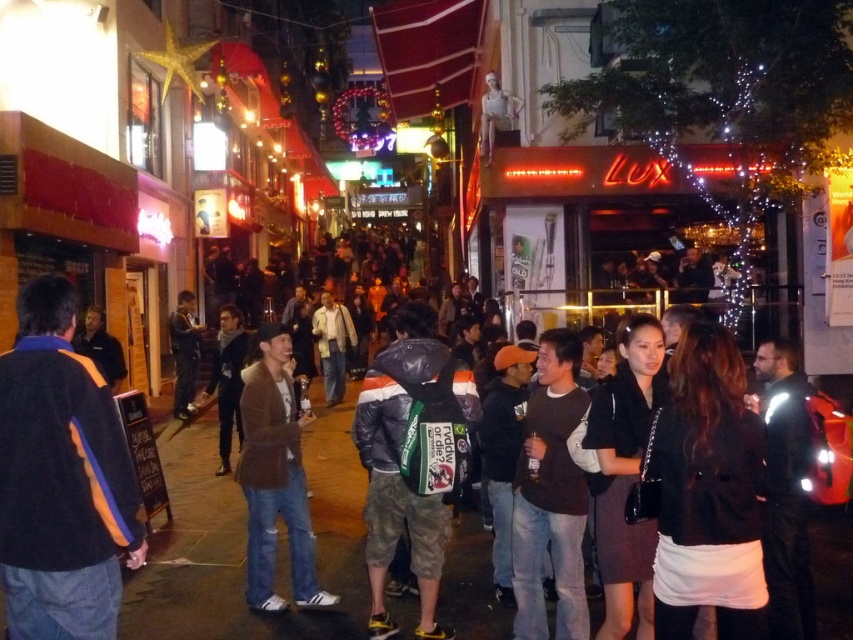
Does dark blue fleece jacket at left have a larger size compared to camouflage fabric backpack at center?

No, dark blue fleece jacket at left is not bigger than camouflage fabric backpack at center.

Does dark blue fleece jacket at left have a lesser width compared to camouflage fabric backpack at center?

Yes.

The image size is (853, 640). I want to click on dark blue fleece jacket at left, so click(x=61, y=477).

Does dark blue fleece jacket at left have a larger size compared to brown cotton jacket at center?

No.

Does dark blue fleece jacket at left appear under brown cotton jacket at center?

No, dark blue fleece jacket at left is not below brown cotton jacket at center.

At what (x,y) coordinates should I click in order to perform the action: click on dark blue fleece jacket at left. Please return your answer as a coordinate pair (x, y). Looking at the image, I should click on (61, 477).

Locate an element on the screen. dark blue fleece jacket at left is located at coordinates (61, 477).

Looking at this image, who is more distant from viewer, (309, 600) or (201, 328)?

The point (201, 328) is more distant.

Is point (288, 390) positioned after point (189, 349)?

No, it is in front of (189, 349).

Identify the location of brown cotton jacket at center. (276, 477).